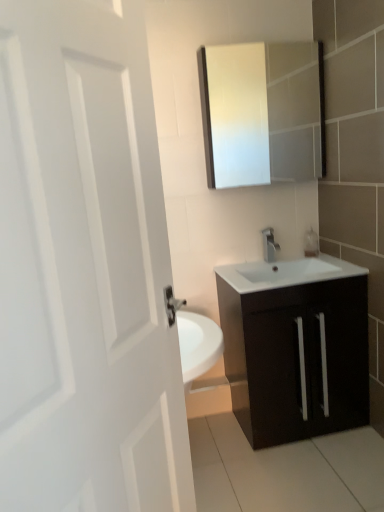
Where is `clear glass soap dispenser at right`? This screenshot has width=384, height=512. clear glass soap dispenser at right is located at coordinates (311, 243).

Where is `white matte door at left`? white matte door at left is located at coordinates (84, 268).

At what (x,y) coordinates should I click in order to perform the action: click on clear glass soap dispenser at right. Please return your answer as a coordinate pair (x, y). The image size is (384, 512). Looking at the image, I should click on (311, 243).

From the picture: Is white glossy medicine cabinet at upper center turned away from white matte door at left?

No, white matte door at left is not at the back of white glossy medicine cabinet at upper center.

From the image's perspective, is white glossy medicine cabinet at upper center positioned above or below white matte door at left?

Based on their image positions, white glossy medicine cabinet at upper center is located above white matte door at left.

Who is bigger, white glossy medicine cabinet at upper center or white matte door at left?

white matte door at left.

How different are the orientations of white glossy medicine cabinet at upper center and white matte door at left in degrees?

54.3 degrees separate the facing orientations of white glossy medicine cabinet at upper center and white matte door at left.

Could you tell me if white glossy medicine cabinet at upper center is turned towards clear glass soap dispenser at right?

No, white glossy medicine cabinet at upper center is not oriented towards clear glass soap dispenser at right.

From a real-world perspective, is white glossy medicine cabinet at upper center located beneath clear glass soap dispenser at right?

No.

Can you confirm if matte dark wood cabinet at lower right is smaller than white glossy medicine cabinet at upper center?

No.

Is matte dark wood cabinet at lower right outside of white glossy medicine cabinet at upper center?

Yes, matte dark wood cabinet at lower right is not within white glossy medicine cabinet at upper center.

Considering the positions of objects matte dark wood cabinet at lower right and white glossy medicine cabinet at upper center in the image provided, who is more to the right, matte dark wood cabinet at lower right or white glossy medicine cabinet at upper center?

Positioned to the right is matte dark wood cabinet at lower right.

In the scene shown: From the image's perspective, would you say white matte door at left is positioned over white glossy medicine cabinet at upper center?

No, from the image's perspective, white matte door at left is not above white glossy medicine cabinet at upper center.

Which is correct: white matte door at left is inside white glossy medicine cabinet at upper center, or outside of it?

white matte door at left is outside white glossy medicine cabinet at upper center.

Considering the sizes of white matte door at left and white glossy medicine cabinet at upper center in the image, is white matte door at left taller or shorter than white glossy medicine cabinet at upper center?

Clearly, white matte door at left is taller compared to white glossy medicine cabinet at upper center.

Can you tell me how much white matte door at left and white glossy medicine cabinet at upper center differ in facing direction?

The angle between the facing direction of white matte door at left and the facing direction of white glossy medicine cabinet at upper center is 54.3 degrees.

Does silver metallic tap at center turn towards matte dark wood cabinet at lower right?

No, silver metallic tap at center is not aimed at matte dark wood cabinet at lower right.

Is silver metallic tap at center positioned in front of matte dark wood cabinet at lower right?

No, the depth of silver metallic tap at center is greater than that of matte dark wood cabinet at lower right.

Measure the distance from silver metallic tap at center to matte dark wood cabinet at lower right.

silver metallic tap at center and matte dark wood cabinet at lower right are 22.83 inches apart from each other.

From a real-world perspective, is silver metallic tap at center over matte dark wood cabinet at lower right?

Indeed, from a real-world perspective, silver metallic tap at center stands above matte dark wood cabinet at lower right.

From the image's perspective, would you say clear glass soap dispenser at right is positioned over white glossy medicine cabinet at upper center?

No, from the image's perspective, clear glass soap dispenser at right is not on top of white glossy medicine cabinet at upper center.

Considering the sizes of clear glass soap dispenser at right and white glossy medicine cabinet at upper center in the image, is clear glass soap dispenser at right taller or shorter than white glossy medicine cabinet at upper center?

In the image, clear glass soap dispenser at right appears to be shorter than white glossy medicine cabinet at upper center.

Is clear glass soap dispenser at right in contact with white glossy medicine cabinet at upper center?

clear glass soap dispenser at right and white glossy medicine cabinet at upper center are not in contact.

Between matte dark wood cabinet at lower right and clear glass soap dispenser at right, which one appears on the right side from the viewer's perspective?

clear glass soap dispenser at right is more to the right.

Locate an element on the screen. The image size is (384, 512). soap dispenser above the matte dark wood cabinet at lower right (from the image's perspective) is located at coordinates (311, 243).

Which object is closer to the camera, matte dark wood cabinet at lower right or clear glass soap dispenser at right?

matte dark wood cabinet at lower right.

Is matte dark wood cabinet at lower right thinner than clear glass soap dispenser at right?

Incorrect, the width of matte dark wood cabinet at lower right is not less than that of clear glass soap dispenser at right.

There is a white matte door at left. Where is `medicine cabinet above it (from a real-world perspective)`? The height and width of the screenshot is (512, 384). medicine cabinet above it (from a real-world perspective) is located at coordinates [262, 112].

The height and width of the screenshot is (512, 384). I want to click on soap dispenser located on the right of white glossy medicine cabinet at upper center, so click(x=311, y=243).

Which object lies nearer to the anchor point matte dark wood cabinet at lower right, silver metallic tap at center or white matte door at left?

silver metallic tap at center is closer to matte dark wood cabinet at lower right.

Estimate the real-world distances between objects in this image. Which object is closer to clear glass soap dispenser at right, silver metallic tap at center or white matte door at left?

Among the two, silver metallic tap at center is located nearer to clear glass soap dispenser at right.

From the image, which object appears to be nearer to white matte door at left, clear glass soap dispenser at right or silver metallic tap at center?

Based on the image, silver metallic tap at center appears to be nearer to white matte door at left.

From the picture: Considering their positions, is clear glass soap dispenser at right positioned closer to white glossy medicine cabinet at upper center than silver metallic tap at center?

Among the two, clear glass soap dispenser at right is located nearer to white glossy medicine cabinet at upper center.

Which object lies nearer to the anchor point matte dark wood cabinet at lower right, white matte door at left or silver metallic tap at center?

silver metallic tap at center lies closer to matte dark wood cabinet at lower right than the other object.

Looking at this image, considering their positions, is matte dark wood cabinet at lower right positioned closer to clear glass soap dispenser at right than white glossy medicine cabinet at upper center?

matte dark wood cabinet at lower right.

Which object lies nearer to the anchor point clear glass soap dispenser at right, white matte door at left or white glossy medicine cabinet at upper center?

The object closer to clear glass soap dispenser at right is white glossy medicine cabinet at upper center.

Based on their spatial positions, is matte dark wood cabinet at lower right or white matte door at left further from silver metallic tap at center?

white matte door at left is further to silver metallic tap at center.

The width and height of the screenshot is (384, 512). I want to click on soap dispenser between white glossy medicine cabinet at upper center and silver metallic tap at center in the up-down direction, so click(311, 243).

You are a GUI agent. You are given a task and a screenshot of the screen. Output one action in this format:
    pyautogui.click(x=<x>, y=<y>)
    Task: Click on the tap between white matte door at left and clear glass soap dispenser at right along the z-axis
    The width and height of the screenshot is (384, 512).
    Given the screenshot: What is the action you would take?
    pyautogui.click(x=269, y=244)

Locate an element on the screen. medicine cabinet located between white matte door at left and clear glass soap dispenser at right in the depth direction is located at coordinates (262, 112).

The image size is (384, 512). I want to click on tap between clear glass soap dispenser at right and matte dark wood cabinet at lower right vertically, so click(269, 244).